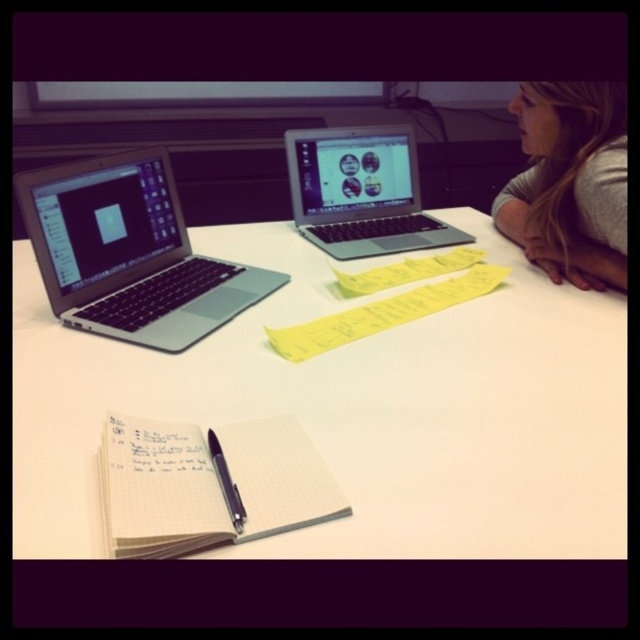
What are the coordinates of the white matte table at center?

The white matte table at center is located at coordinates point (355, 412).

You are organizing your desk and need to place a new item between the gray fabric hair at upper right and the yellow paper at center. The item is 15 centimeters long. Will there be enough space between them to fit the item?

The gray fabric hair at upper right is 26.72 centimeters from yellow paper at center. Since the item is 15 centimeters long, there is enough space between them to fit the item as 26.72 cm is greater than 15 cm.

From the picture: You are organizing your desk and need to place a new item between the silver metallic laptop at left and the white paper notebook at lower center. Based on their positions, where should you place the item to ensure it is between them?

The silver metallic laptop at left is above the white paper notebook at lower center. To place an item between them, position it in the space between the laptop and the notebook, which would be somewhere below the laptop but above the notebook.